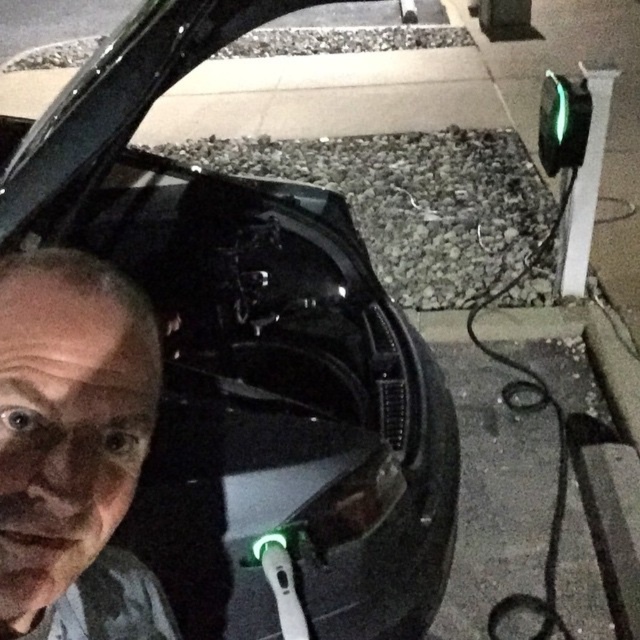
You are a photographer trying to capture a clear image of the black glossy car at center and the gray matte face at center in the nighttime scene. Since the trunk has a green light, which object is blocking the view of the other? Please explain.

The black glossy car at center is positioned over the gray matte face at center, so the car is blocking the view of the face.

You are holding a 24 inch wide box and want to place it between yourself and the black glossy car at center. Is there enough space for the box to fit without touching either the car or your body?

The distance between the black glossy car at center and the viewer is 22.75 inches, which is less than the box width of 24 inches. Therefore, the box cannot fit between them without overlapping.